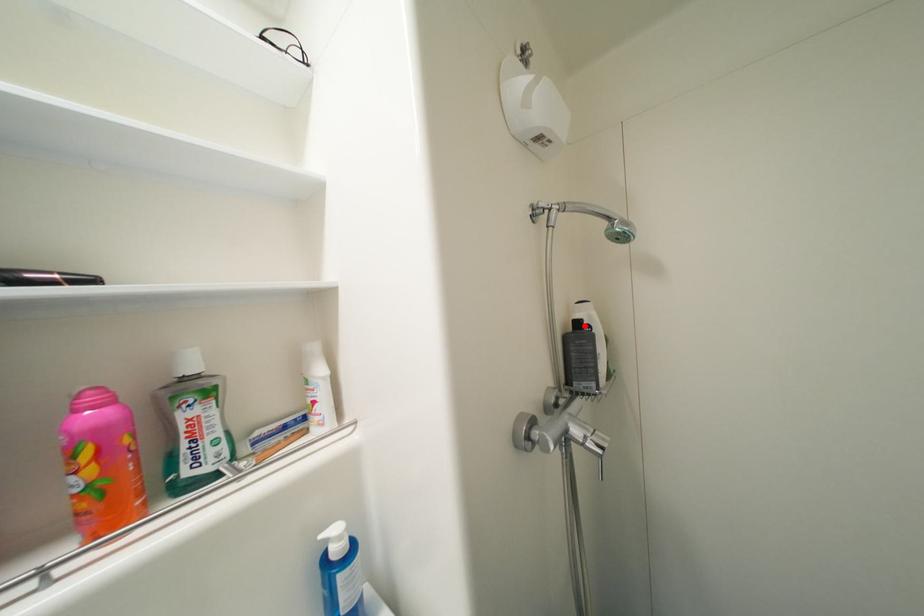
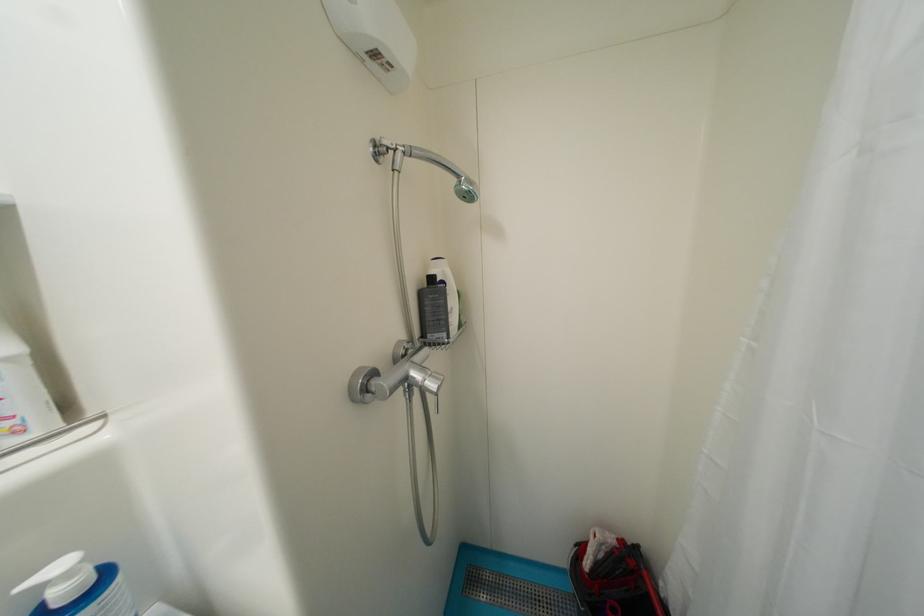
The point at the highlighted location is marked in the first image. Where is the corresponding point in the second image?

(439, 281)